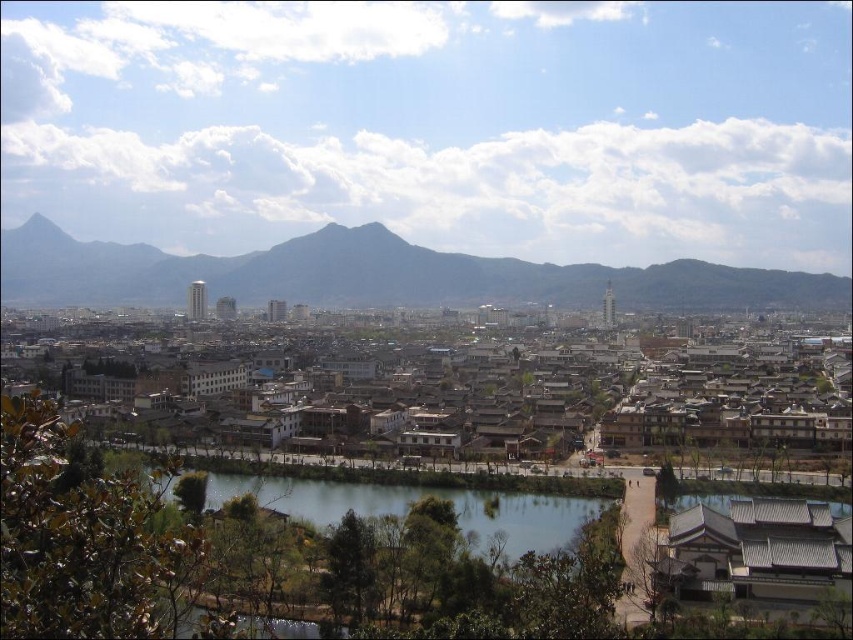
Is matte gray mountain at center further to camera compared to green smooth water at center?

Yes, matte gray mountain at center is further from the viewer.

Where is `matte gray mountain at center`? This screenshot has width=853, height=640. matte gray mountain at center is located at coordinates (380, 275).

Does point (178, 276) come closer to viewer compared to point (308, 488)?

No, it is behind (308, 488).

Locate an element on the screen. The image size is (853, 640). matte gray mountain at center is located at coordinates (380, 275).